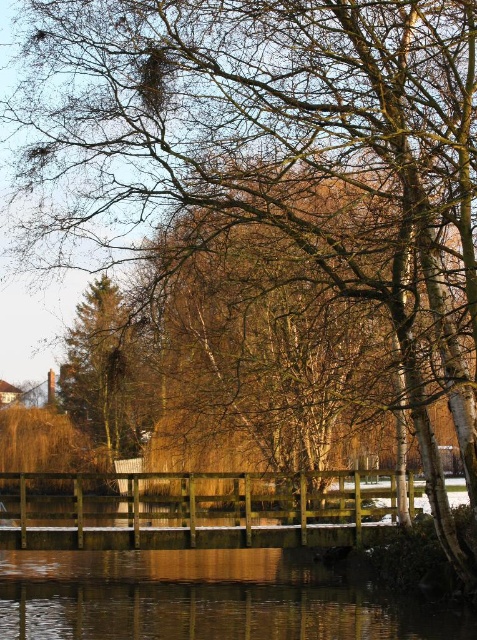
You are standing on the wooden bridge and looking down. You see the transparent water at lower center and the green matte tree at left. Which object is closer to your right side?

The transparent water at lower center is closer to your right side because it is positioned on the right side of the green matte tree at left.

You are a hiker who wants to cross the wooden bridge in the winter scene. You have a 10 meter long rope with you. If you want to tie the rope between the transparent water at lower center and the green matte tree at left, will the rope be long enough?

The transparent water at lower center and the green matte tree at left are 9.13 meters apart from each other. Since the rope is 10 meters long, it will be long enough to tie between them.